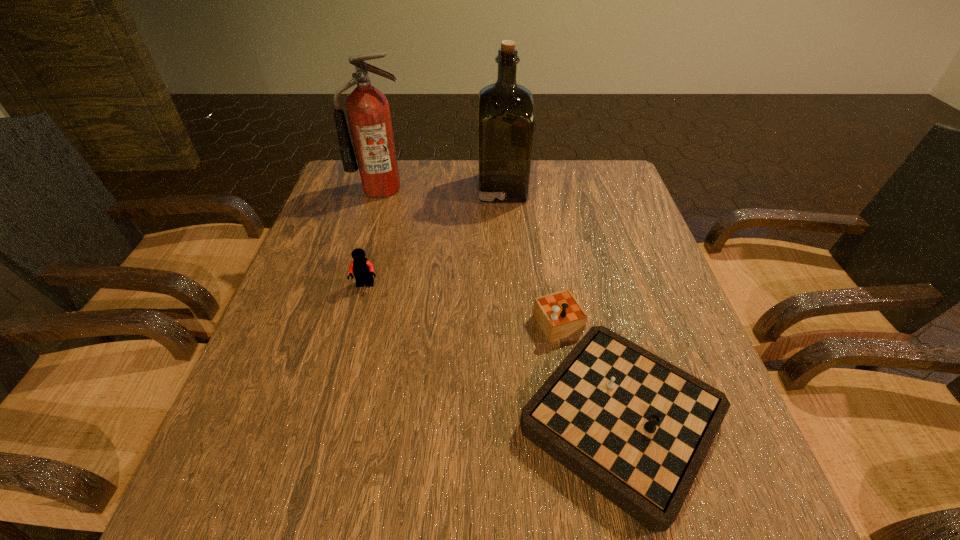
Locate an element on the screen. free region that satisfies the following two spatial constraints: 1. on the front of the fire extinguisher near the operation label; 2. on the right side of the nearest object is located at coordinates (321, 396).